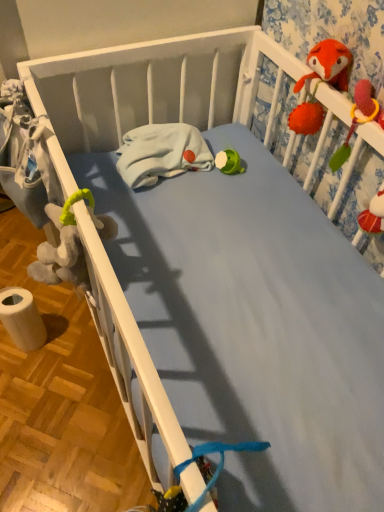
What do you see at coordinates (22, 318) in the screenshot? I see `white paper towel at lower left` at bounding box center [22, 318].

Locate an element on the screen. Image resolution: width=384 pixels, height=512 pixels. soft plush toy at upper right is located at coordinates (358, 119).

From a real-world perspective, is soft plush toy at upper right positioned above or below white fleece blanket at center?

soft plush toy at upper right is above white fleece blanket at center.

The width and height of the screenshot is (384, 512). I want to click on toy in front of the white fleece blanket at center, so click(358, 119).

Is soft plush toy at upper right bigger than white fleece blanket at center?

No, soft plush toy at upper right is not bigger than white fleece blanket at center.

Which is correct: soft plush toy at upper right is inside white fleece blanket at center, or outside of it?

soft plush toy at upper right is located beyond the bounds of white fleece blanket at center.

Is white fleece blanket at center not within white paper towel at lower left?

Yes.

From the image's perspective, does white fleece blanket at center appear lower than white paper towel at lower left?

No, from the image's perspective, white fleece blanket at center is not below white paper towel at lower left.

Which is behind, point (151, 133) or point (14, 319)?

The point (14, 319) is behind.

Between white fleece blanket at center and white paper towel at lower left, which one appears on the left side from the viewer's perspective?

From the viewer's perspective, white paper towel at lower left appears more on the left side.

From a real-world perspective, is white paper towel at lower left physically above soft plush toy at upper right?

Incorrect, from a real-world perspective, white paper towel at lower left is lower than soft plush toy at upper right.

At what (x,y) coordinates should I click in order to perform the action: click on toy that appears above the white paper towel at lower left (from the image's perspective). Please return your answer as a coordinate pair (x, y). The width and height of the screenshot is (384, 512). Looking at the image, I should click on (358, 119).

Is white paper towel at lower left facing away from soft plush toy at upper right?

No, white paper towel at lower left's orientation is not away from soft plush toy at upper right.

Which object is further away from the camera, white paper towel at lower left or white fleece blanket at center?

white paper towel at lower left is more distant.

Which of these two, white paper towel at lower left or white fleece blanket at center, stands taller?

white paper towel at lower left.

From the image's perspective, is white paper towel at lower left on top of white fleece blanket at center?

Incorrect, from the image's perspective, white paper towel at lower left is lower than white fleece blanket at center.

Is white fleece blanket at center at the back of white paper towel at lower left?

That's not correct — white paper towel at lower left is not looking away from white fleece blanket at center.

At what (x,y) coordinates should I click in order to perform the action: click on toilet paper on the left of soft plush toy at upper right. Please return your answer as a coordinate pair (x, y). Image resolution: width=384 pixels, height=512 pixels. Looking at the image, I should click on pos(22,318).

Looking at this image, from the image's perspective, is soft plush toy at upper right located above or below white paper towel at lower left?

soft plush toy at upper right is situated higher than white paper towel at lower left in the image.

How much distance is there between soft plush toy at upper right and white paper towel at lower left?

soft plush toy at upper right and white paper towel at lower left are 38.28 inches apart.

Which point is more forward, (351,123) or (27,336)?

Point (351,123)

Considering the positions of objects white fleece blanket at center and soft plush toy at upper right in the image provided, who is behind, white fleece blanket at center or soft plush toy at upper right?

white fleece blanket at center.

What's the angular difference between white fleece blanket at center and soft plush toy at upper right's facing directions?

The angular difference between white fleece blanket at center and soft plush toy at upper right is 95.7 degrees.

Is white fleece blanket at center to the left of soft plush toy at upper right from the viewer's perspective?

Yes.

Is point (173, 160) farther from camera compared to point (381, 118)?

Yes.

This screenshot has height=512, width=384. In order to click on material that appears above the soft plush toy at upper right (from the image's perspective) in this screenshot , I will do `click(161, 153)`.

Where is `toilet paper that appears on the left of white fleece blanket at center`? toilet paper that appears on the left of white fleece blanket at center is located at coordinates (22, 318).

Considering their positions, is soft plush toy at upper right positioned closer to white fleece blanket at center than white paper towel at lower left?

Among the two, soft plush toy at upper right is located nearer to white fleece blanket at center.

Based on their spatial positions, is soft plush toy at upper right or white fleece blanket at center closer to white paper towel at lower left?

Based on the image, white fleece blanket at center appears to be nearer to white paper towel at lower left.

Considering their positions, is white paper towel at lower left positioned further to soft plush toy at upper right than white fleece blanket at center?

white paper towel at lower left is positioned further to the anchor soft plush toy at upper right.

Which object lies further to the anchor point soft plush toy at upper right, white fleece blanket at center or white paper towel at lower left?

white paper towel at lower left.

Which object lies further to the anchor point white paper towel at lower left, white fleece blanket at center or soft plush toy at upper right?

Among the two, soft plush toy at upper right is located further to white paper towel at lower left.

Looking at the image, which one is located closer to white fleece blanket at center, white paper towel at lower left or soft plush toy at upper right?

Among the two, soft plush toy at upper right is located nearer to white fleece blanket at center.

I want to click on material located between white paper towel at lower left and soft plush toy at upper right in the left-right direction, so click(161, 153).